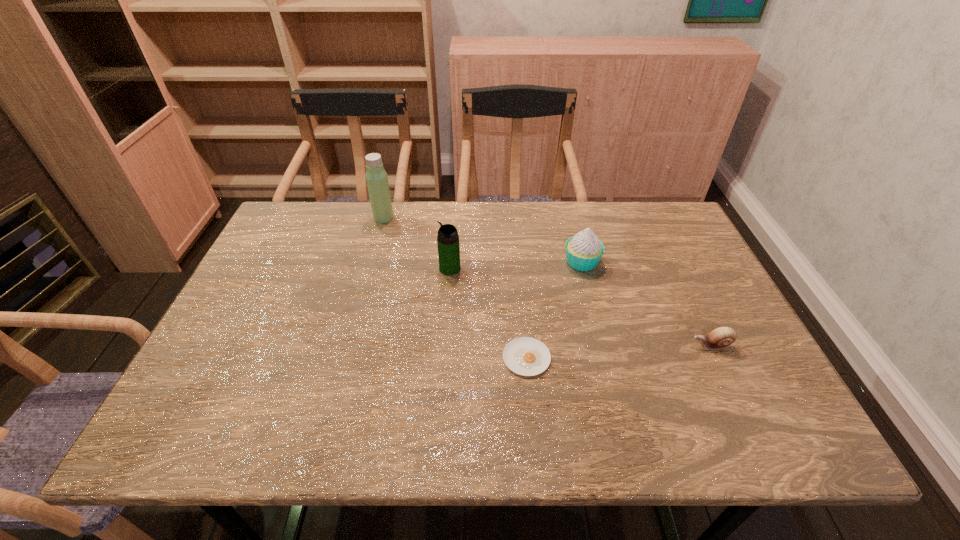
Locate an element on the screen. free space between the shorter thermos bottle and the fourth tallest object is located at coordinates (581, 307).

I want to click on free space between the fourth tallest object and the third object from left to right, so click(619, 352).

Locate an element on the screen. free space between the shortest object and the shorter thermos bottle is located at coordinates click(x=488, y=313).

Find the location of `vacant region between the taller thermos bottle and the second object from left to right`. vacant region between the taller thermos bottle and the second object from left to right is located at coordinates (417, 243).

What are the coordinates of `unoccupied area between the fourth object from right to left and the tallest object` in the screenshot? It's located at 417,243.

Point out which object is positioned as the fourth nearest to the tallest object. Please provide its 2D coordinates. Your answer should be formatted as a tuple, i.e. [(x, y)], where the tuple contains the x and y coordinates of a point satisfying the conditions above.

[(722, 337)]

Locate which object ranks third in proximity to the leftmost object. Please provide its 2D coordinates. Your answer should be formatted as a tuple, i.e. [(x, y)], where the tuple contains the x and y coordinates of a point satisfying the conditions above.

[(526, 356)]

Locate an element on the screen. This screenshot has width=960, height=540. blank space that satisfies the following two spatial constraints: 1. from the spout of the shortest object; 2. on the left side of the right thermos bottle is located at coordinates (444, 357).

Find the location of a particular element. This screenshot has height=540, width=960. vacant space that satisfies the following two spatial constraints: 1. on the front-facing side of the rightmost object; 2. on the front side of the shortest object is located at coordinates (717, 357).